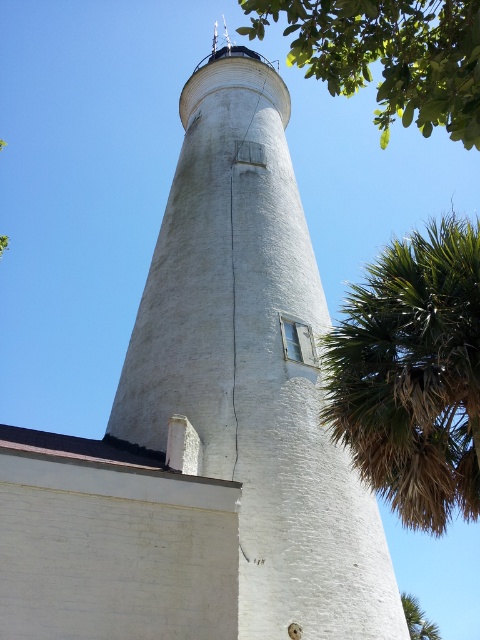
You are standing at the base of the white textured tower at center and want to see the top of the brown leafy palm tree at right. Considering their heights, will the palm tree be visible above the tower?

The white textured tower at center is taller than the brown leafy palm tree at right, so the palm tree will not be visible above the tower.